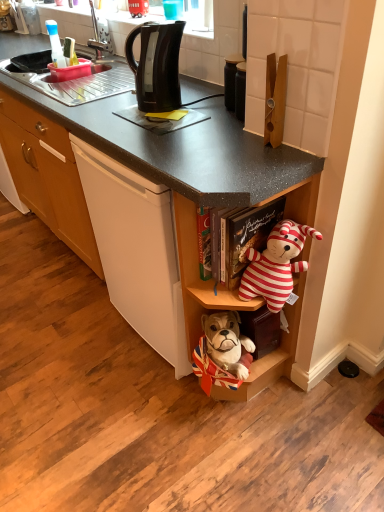
Image resolution: width=384 pixels, height=512 pixels. What are the coordinates of `vacant space in between black plastic kettle at upper center and black matte jar at upper center` in the screenshot? It's located at (204, 104).